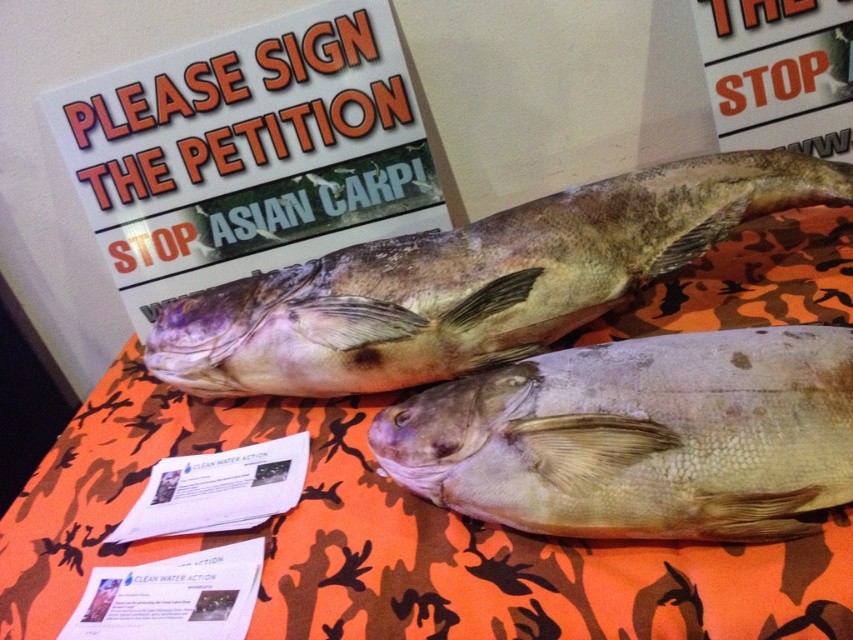
Question: Does speckled skin fish at center lie in front of white paper at upper right?

Choices:
 (A) no
 (B) yes

Answer: (B)

Question: Is grayish matte fish at center closer to camera compared to speckled skin fish at center?

Choices:
 (A) no
 (B) yes

Answer: (B)

Question: In this image, where is grayish matte fish at center located relative to speckled skin fish at center?

Choices:
 (A) below
 (B) above

Answer: (A)

Question: Among these points, which one is farthest from the camera?

Choices:
 (A) (643, 422)
 (B) (732, 38)
 (C) (846, 173)

Answer: (B)

Question: Which is farther from the grayish matte fish at center?

Choices:
 (A) orange camo table at center
 (B) white paper at upper right
 (C) white paper sign at upper left
 (D) speckled skin fish at center

Answer: (B)

Question: Which object is the farthest from the speckled skin fish at center?

Choices:
 (A) orange camo table at center
 (B) grayish matte fish at center
 (C) white paper at upper right

Answer: (C)